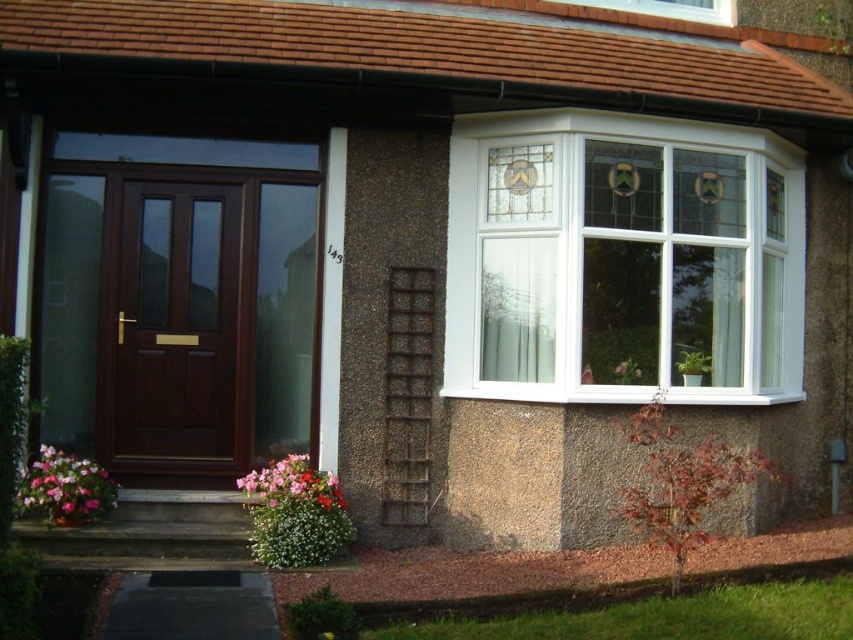
Question: Can you confirm if matte brown door at center is smaller than multicolored fabric flower at lower center?

Choices:
 (A) yes
 (B) no

Answer: (B)

Question: Does matte brown door at center have a lesser width compared to multicolored fabric flower at lower center?

Choices:
 (A) yes
 (B) no

Answer: (B)

Question: Can you confirm if matte brown door at center is positioned below pink matte flower at lower left?

Choices:
 (A) yes
 (B) no

Answer: (B)

Question: Which is farther from the white plastic bay window at upper right?

Choices:
 (A) multicolored fabric flower at lower center
 (B) matte brown door at center

Answer: (B)

Question: Considering the real-world distances, which object is farthest from the matte brown door at center?

Choices:
 (A) pink matte flower at lower left
 (B) white plastic bay window at upper right
 (C) multicolored fabric flower at lower center

Answer: (B)

Question: Which point is closer to the camera?

Choices:
 (A) (279, 496)
 (B) (784, 221)
 (C) (73, 461)

Answer: (A)